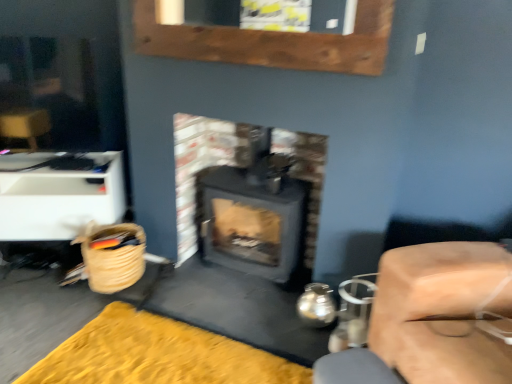
This screenshot has width=512, height=384. What are the coordinates of `free space to the left of woven straw basket at lower left` in the screenshot? It's located at (51, 295).